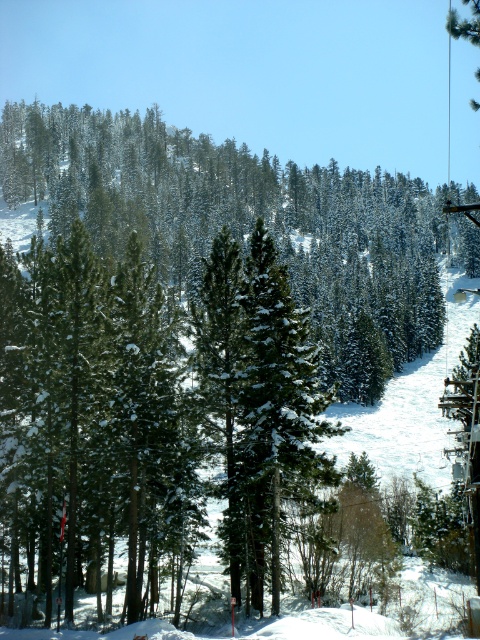
Is green textured pine at center to the left of green matte tree at center from the viewer's perspective?

In fact, green textured pine at center is to the right of green matte tree at center.

Can you confirm if green textured pine at center is positioned to the right of green matte tree at center?

Indeed, green textured pine at center is positioned on the right side of green matte tree at center.

What are the coordinates of `green textured pine at center` in the screenshot? It's located at (244, 224).